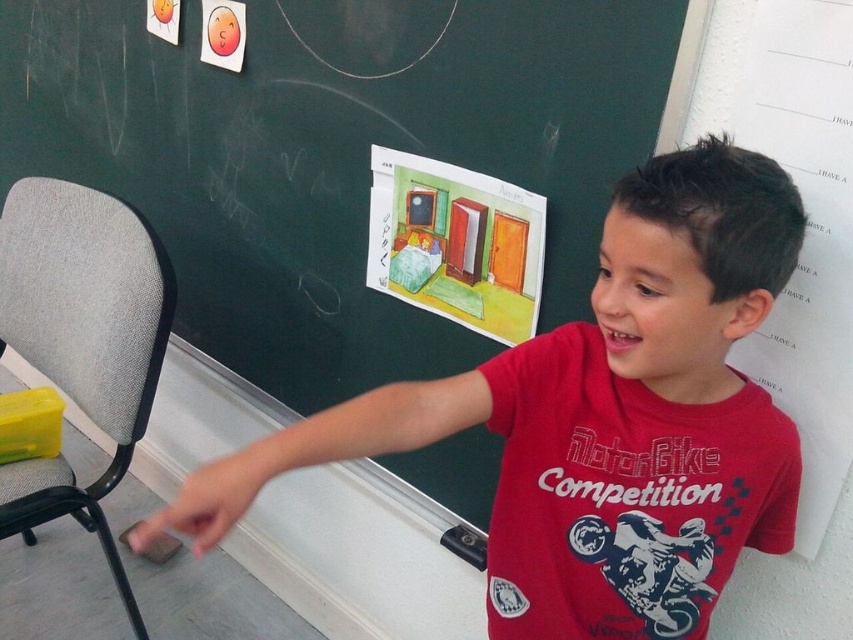
Does matte paper drawing at upper center have a lesser width compared to gray fabric chair at left?

Incorrect, matte paper drawing at upper center's width is not less than gray fabric chair at left's.

Which of these two, matte paper drawing at upper center or gray fabric chair at left, stands shorter?

gray fabric chair at left

This screenshot has height=640, width=853. Describe the element at coordinates (334, 154) in the screenshot. I see `matte paper drawing at upper center` at that location.

The height and width of the screenshot is (640, 853). In order to click on matte paper drawing at upper center in this screenshot , I will do `click(334, 154)`.

In the scene shown: Is the position of matte paper drawing at upper center less distant than that of red cotton shirt at center?

No, matte paper drawing at upper center is behind red cotton shirt at center.

Is point (297, 49) less distant than point (578, 525)?

No, it is not.

Identify the location of matte paper drawing at upper center. (334, 154).

Is red cotton shirt at center to the right of gray fabric chair at left from the viewer's perspective?

Yes, red cotton shirt at center is to the right of gray fabric chair at left.

Who is positioned more to the right, red cotton shirt at center or gray fabric chair at left?

red cotton shirt at center

The image size is (853, 640). What are the coordinates of `red cotton shirt at center` in the screenshot? It's located at (599, 419).